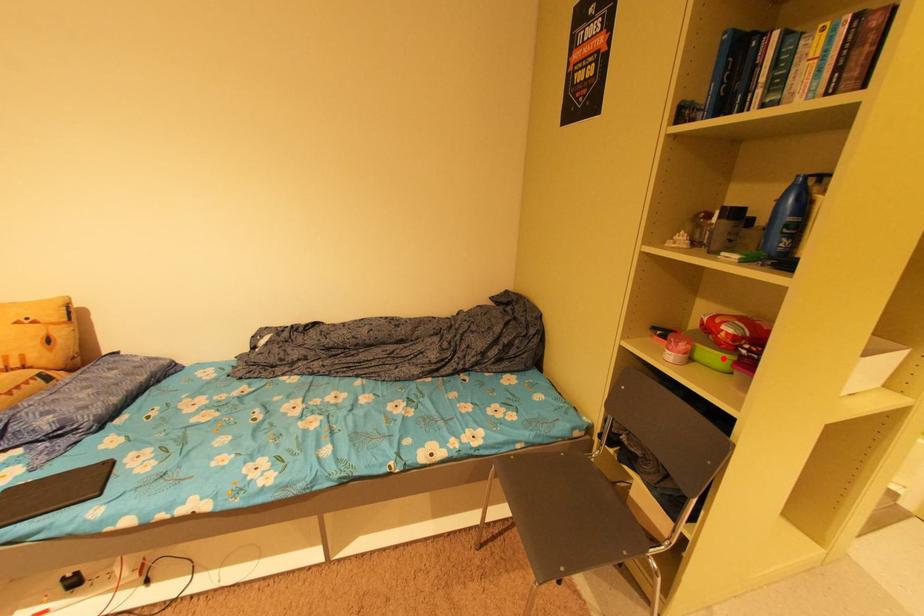
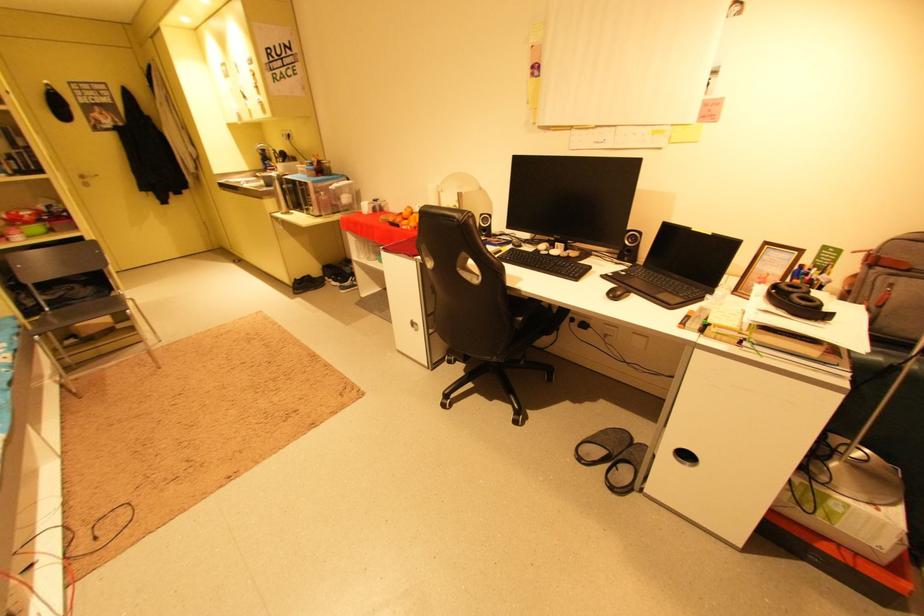
Question: I am providing you with two images of the same scene from different viewpoints. Given a red point in image1, look at the same physical point in image2. Is it:

Choices:
 (A) Closer to the viewpoint
 (B) Farther from the viewpoint

Answer: (B)